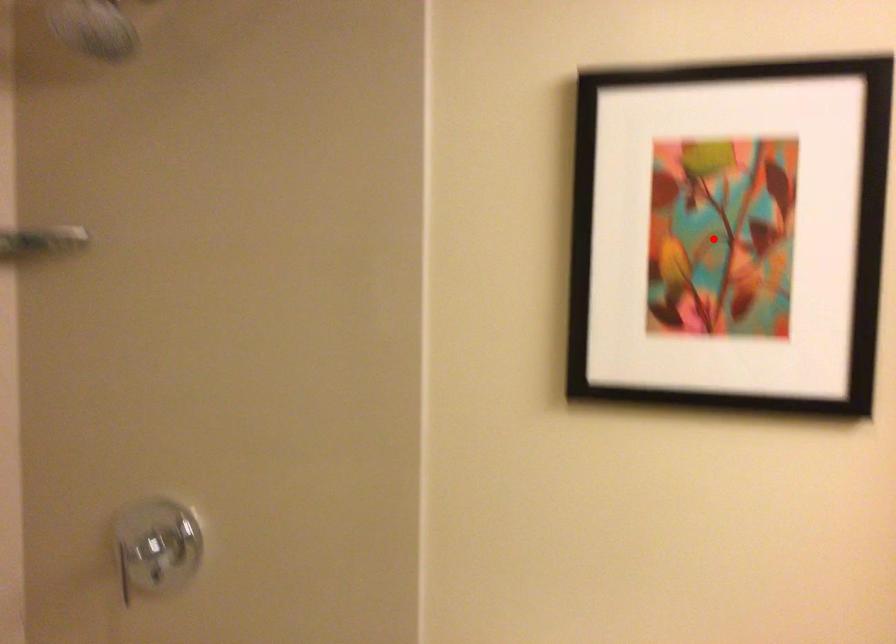
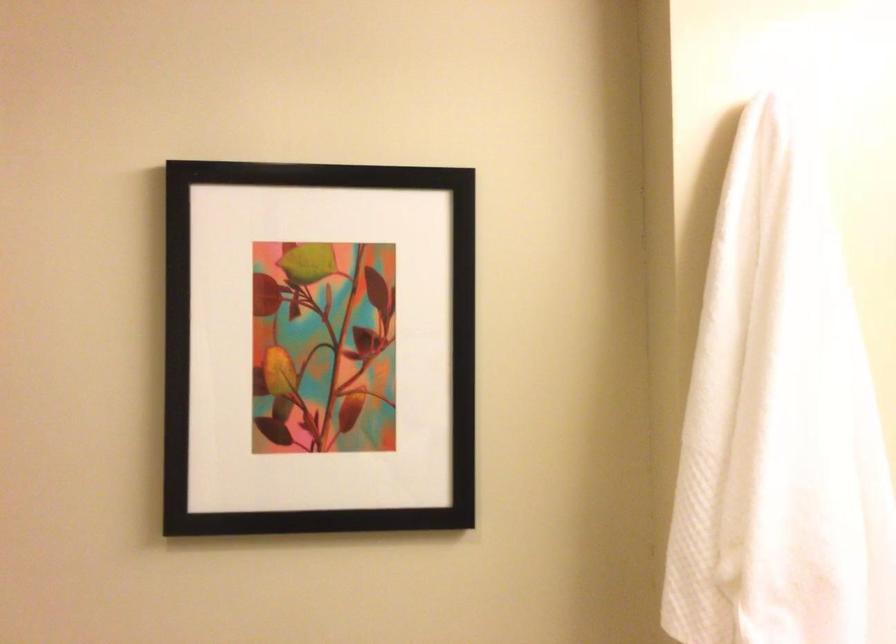
Question: I am providing you with two images of the same scene from different viewpoints. A red point is marked on the first image. At the location where the point appears in image 1, is it still visible in image 2?

Choices:
 (A) Yes
 (B) No

Answer: (A)